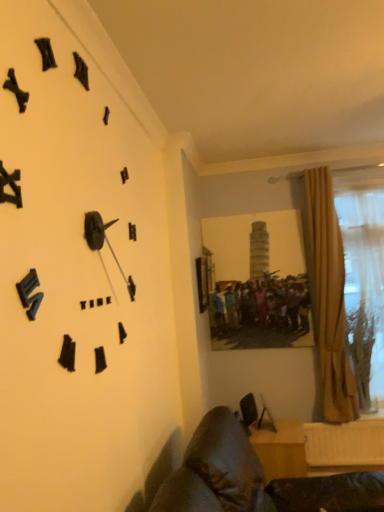
Question: Can you confirm if leather couch at lower left, which is the second furniture in back-to-front order, is positioned to the left of wooden desk at lower right, placed as the 2th furniture when sorted from front to back?

Choices:
 (A) yes
 (B) no

Answer: (A)

Question: Considering the relative sizes of leather couch at lower left, which is the second furniture in back-to-front order, and wooden desk at lower right, arranged as the 1th furniture when viewed from the back, in the image provided, is leather couch at lower left, which is the second furniture in back-to-front order, shorter than wooden desk at lower right, arranged as the 1th furniture when viewed from the back,?

Choices:
 (A) yes
 (B) no

Answer: (B)

Question: Is wooden desk at lower right, arranged as the 1th furniture when viewed from the back, completely or partially inside leather couch at lower left, which is the first furniture from front to back?

Choices:
 (A) yes
 (B) no

Answer: (B)

Question: Could you tell me if leather couch at lower left, which is the first furniture from front to back, is facing wooden desk at lower right, placed as the 2th furniture when sorted from front to back?

Choices:
 (A) yes
 (B) no

Answer: (B)

Question: Considering the relative positions of leather couch at lower left, which is the first furniture from front to back, and wooden desk at lower right, arranged as the 1th furniture when viewed from the back, in the image provided, is leather couch at lower left, which is the first furniture from front to back, to the right of wooden desk at lower right, arranged as the 1th furniture when viewed from the back, from the viewer's perspective?

Choices:
 (A) no
 (B) yes

Answer: (A)

Question: Is leather couch at lower left, which is the second furniture in back-to-front order, smaller than wooden desk at lower right, placed as the 2th furniture when sorted from front to back?

Choices:
 (A) yes
 (B) no

Answer: (B)

Question: Is wooden desk at lower right, arranged as the 1th furniture when viewed from the back, positioned beyond the bounds of leather couch at lower left, which is the first furniture from front to back?

Choices:
 (A) yes
 (B) no

Answer: (A)

Question: Is wooden desk at lower right, arranged as the 1th furniture when viewed from the back, looking in the opposite direction of leather couch at lower left, which is the first furniture from front to back?

Choices:
 (A) no
 (B) yes

Answer: (A)

Question: From a real-world perspective, is wooden desk at lower right, placed as the 2th furniture when sorted from front to back, below leather couch at lower left, which is the second furniture in back-to-front order?

Choices:
 (A) yes
 (B) no

Answer: (A)

Question: Is leather couch at lower left, which is the first furniture from front to back, completely or partially inside wooden desk at lower right, arranged as the 1th furniture when viewed from the back?

Choices:
 (A) yes
 (B) no

Answer: (B)

Question: Is wooden desk at lower right, placed as the 2th furniture when sorted from front to back, in front of leather couch at lower left, which is the first furniture from front to back?

Choices:
 (A) no
 (B) yes

Answer: (A)

Question: Considering the relative sizes of wooden desk at lower right, arranged as the 1th furniture when viewed from the back, and leather couch at lower left, which is the second furniture in back-to-front order, in the image provided, is wooden desk at lower right, arranged as the 1th furniture when viewed from the back, smaller than leather couch at lower left, which is the second furniture in back-to-front order,?

Choices:
 (A) yes
 (B) no

Answer: (A)

Question: Does leather couch at lower left, which is the first furniture from front to back, have a lesser height compared to black matte clock at upper left?

Choices:
 (A) no
 (B) yes

Answer: (B)